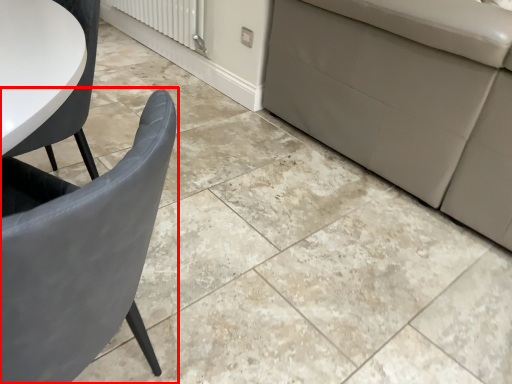
Question: Considering the relative positions of chair (annotated by the red box) and radiator in the image provided, where is chair (annotated by the red box) located with respect to the staircase?

Choices:
 (A) right
 (B) left

Answer: (A)